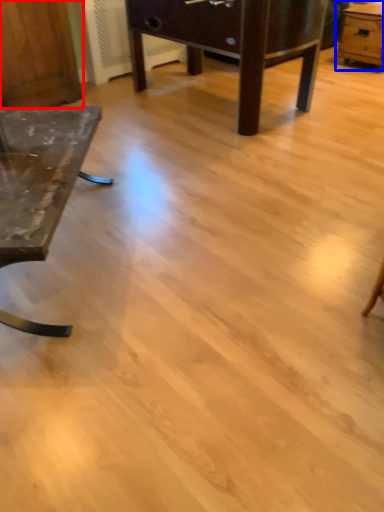
Question: Which point is further to the camera, dresser (highlighted by a red box) or table (highlighted by a blue box)?

Choices:
 (A) dresser
 (B) table

Answer: (B)